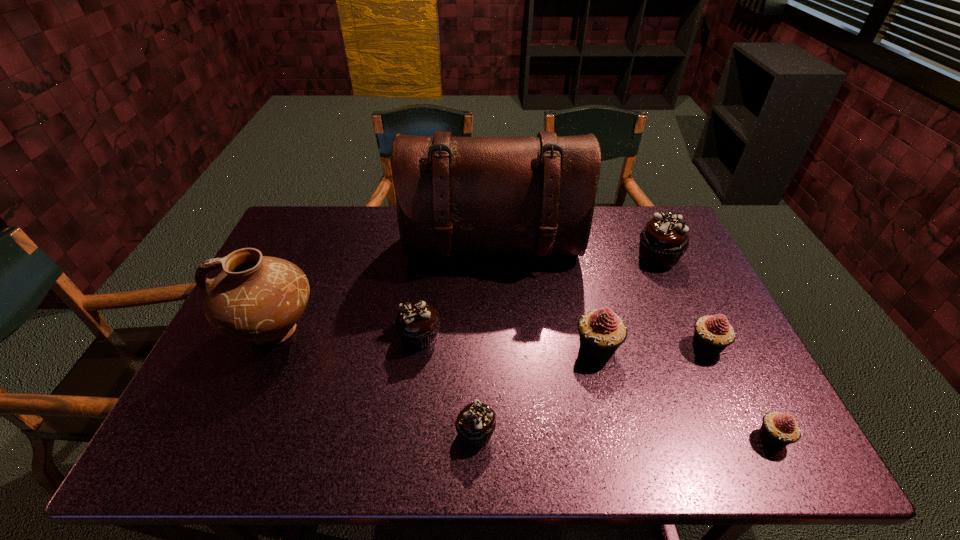
Image resolution: width=960 pixels, height=540 pixels. I want to click on brown satchel, so click(x=470, y=195).

Find the location of a particular element. This screenshot has width=960, height=540. the tallest object is located at coordinates (470, 195).

Identify the location of the leftmost object. The width and height of the screenshot is (960, 540). (257, 298).

Where is `pottery`? The image size is (960, 540). pottery is located at coordinates (257, 298).

Find the location of a particular element. Image resolution: width=960 pixels, height=540 pixels. the biggest pink cupcake is located at coordinates (601, 332).

The height and width of the screenshot is (540, 960). I want to click on the fourth cupcake from right to left, so click(x=601, y=332).

Find the location of a particular element. the biggest brown cupcake is located at coordinates (664, 239).

Locate an element on the screen. This screenshot has height=540, width=960. the farthest brown cupcake is located at coordinates (664, 239).

Identify the location of the second nearest brown cupcake. (417, 323).

I want to click on the leftmost cupcake, so click(x=417, y=323).